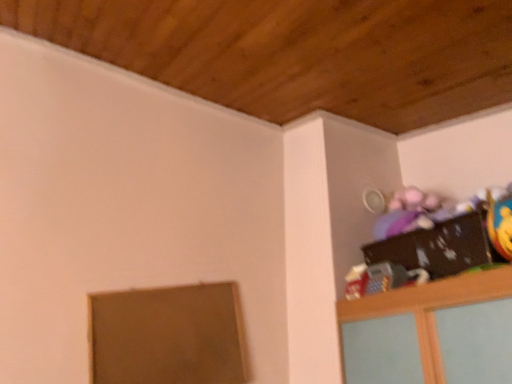
Image resolution: width=512 pixels, height=384 pixels. I want to click on brown matte bulletin board at lower left, so click(167, 336).

Describe the element at coordinates (167, 336) in the screenshot. I see `brown matte bulletin board at lower left` at that location.

The image size is (512, 384). Find the location of `brown matte bulletin board at lower left`. brown matte bulletin board at lower left is located at coordinates (167, 336).